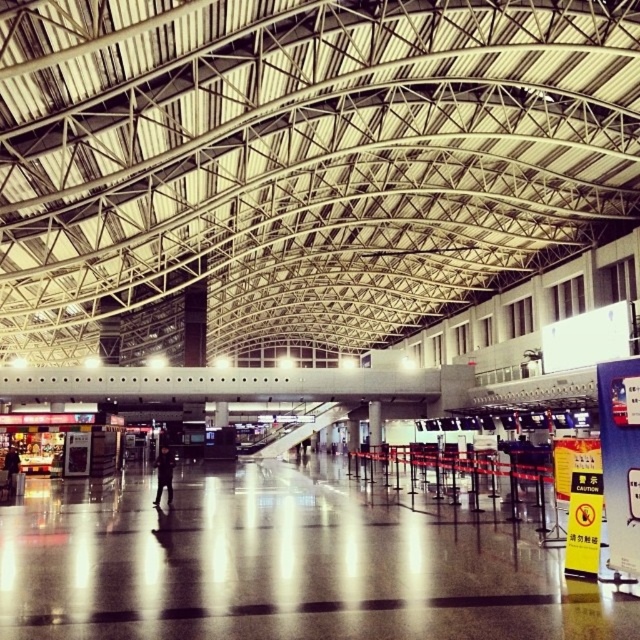
Question: Which point is closer to the camera?

Choices:
 (A) dark gray suit at left
 (B) black matte person at center

Answer: (B)

Question: Is black matte person at center positioned in front of dark gray suit at left?

Choices:
 (A) no
 (B) yes

Answer: (B)

Question: Where is black matte person at center located in relation to dark gray suit at left in the image?

Choices:
 (A) above
 (B) below

Answer: (B)

Question: Which point is closer to the camera?

Choices:
 (A) (8, 490)
 (B) (168, 468)

Answer: (B)

Question: Is black matte person at center to the left of dark gray suit at left from the viewer's perspective?

Choices:
 (A) no
 (B) yes

Answer: (A)

Question: Which object is farther from the camera taking this photo?

Choices:
 (A) dark gray suit at left
 (B) black matte person at center

Answer: (A)